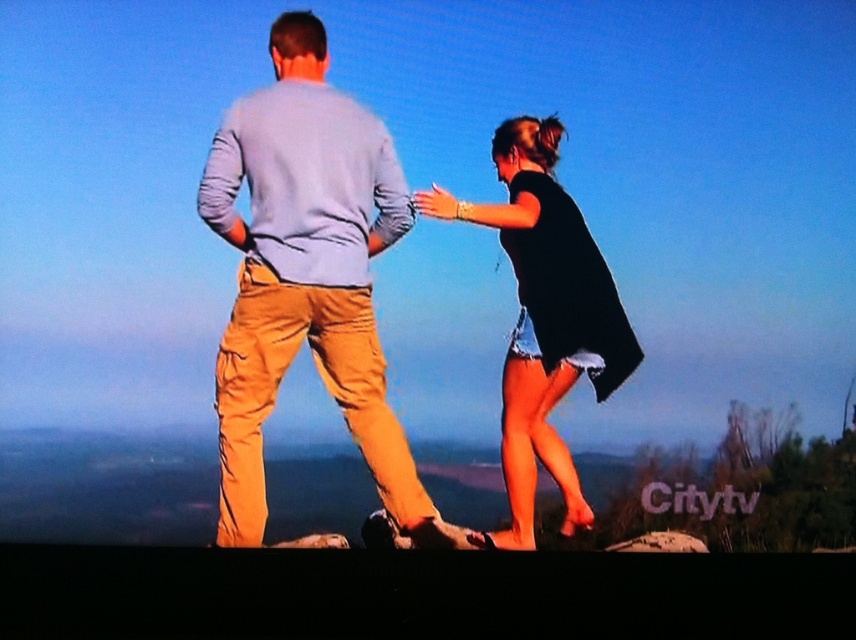
Question: Can you confirm if black cotton dress at center is bigger than orange leather glove at center?

Choices:
 (A) yes
 (B) no

Answer: (A)

Question: Which object is farther from the camera taking this photo?

Choices:
 (A) black cotton dress at center
 (B) orange leather glove at center

Answer: (B)

Question: Considering the relative positions of light blue cotton shirt at center and black cotton dress at center in the image provided, where is light blue cotton shirt at center located with respect to black cotton dress at center?

Choices:
 (A) right
 (B) left

Answer: (B)

Question: Which object appears closest to the camera in this image?

Choices:
 (A) orange leather glove at center
 (B) black cotton dress at center
 (C) light blue cotton shirt at center

Answer: (C)

Question: Does light blue cotton shirt at center come behind black cotton dress at center?

Choices:
 (A) no
 (B) yes

Answer: (A)

Question: Estimate the real-world distances between objects in this image. Which object is farther from the orange leather glove at center?

Choices:
 (A) light blue cotton shirt at center
 (B) black cotton dress at center

Answer: (A)